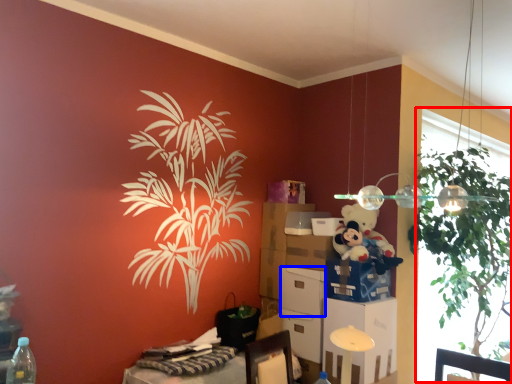
Question: Which point is closer to the camera, window screen (highlighted by a red box) or box (highlighted by a blue box)?

Choices:
 (A) window screen
 (B) box

Answer: (A)